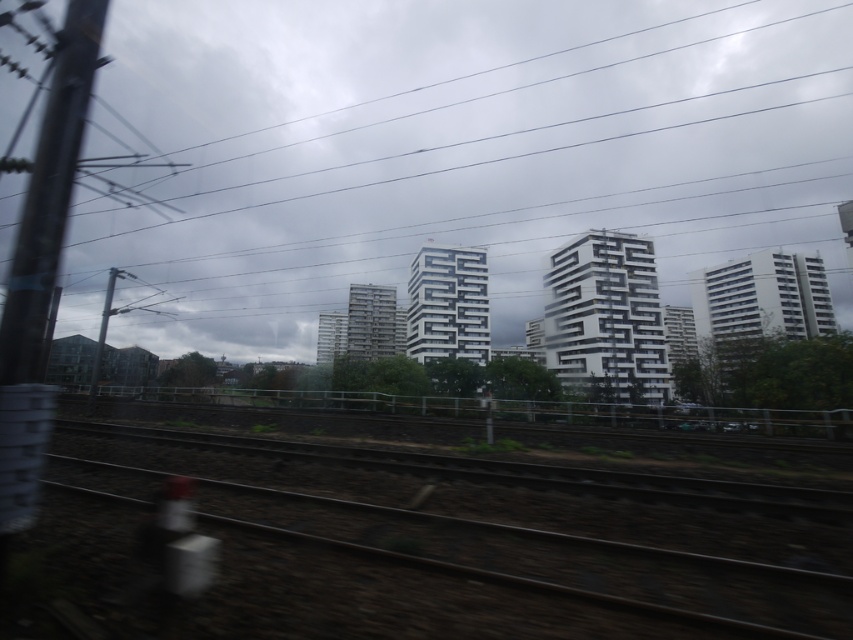
Question: Is white matte building at center bigger than brown dirt at bottom?

Choices:
 (A) yes
 (B) no

Answer: (A)

Question: Is white matte building at center smaller than brown dirt at bottom?

Choices:
 (A) no
 (B) yes

Answer: (A)

Question: Which point is farther to the camera?

Choices:
 (A) coord(646,97)
 (B) coord(227,513)

Answer: (A)

Question: Which point appears farthest from the camera in this image?

Choices:
 (A) (252, 257)
 (B) (402, 548)

Answer: (A)

Question: Does white matte building at center have a larger size compared to brown dirt at bottom?

Choices:
 (A) no
 (B) yes

Answer: (B)